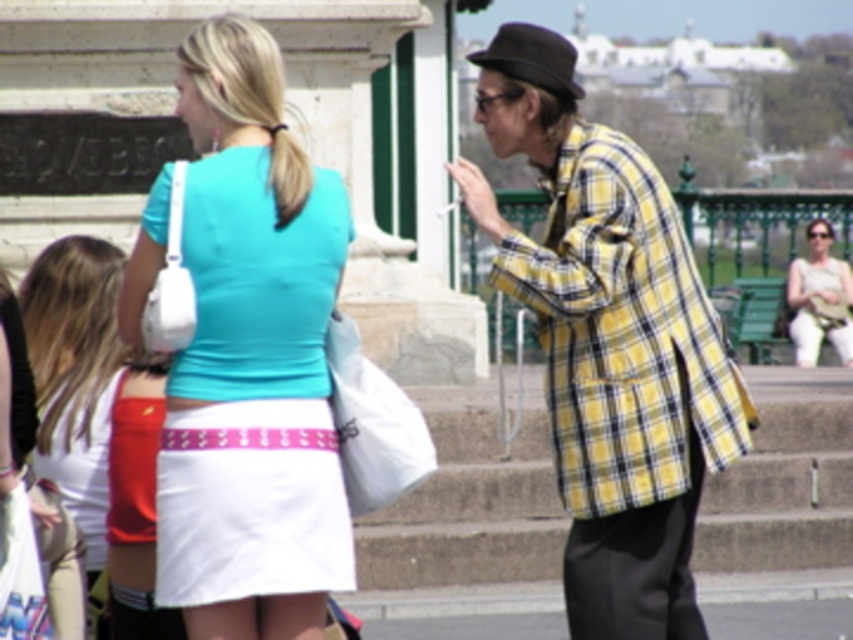
Question: Does yellow plaid jacket at center have a lesser width compared to white cotton skirt at lower left?

Choices:
 (A) yes
 (B) no

Answer: (B)

Question: Which object is closer to the camera taking this photo?

Choices:
 (A) matte teal blouse at center
 (B) yellow plaid jacket at center

Answer: (A)

Question: Which point is closer to the camera taking this photo?

Choices:
 (A) (490, 45)
 (B) (834, 260)
 (C) (509, 77)

Answer: (C)

Question: From the image, what is the correct spatial relationship of yellow plaid jacket at center in relation to white cotton skirt at lower left?

Choices:
 (A) below
 (B) above

Answer: (A)

Question: Does matte teal blouse at center appear on the left side of black felt fedora at upper right?

Choices:
 (A) yes
 (B) no

Answer: (A)

Question: Which of the following is the farthest from the observer?

Choices:
 (A) (675, 253)
 (B) (521, 36)

Answer: (B)